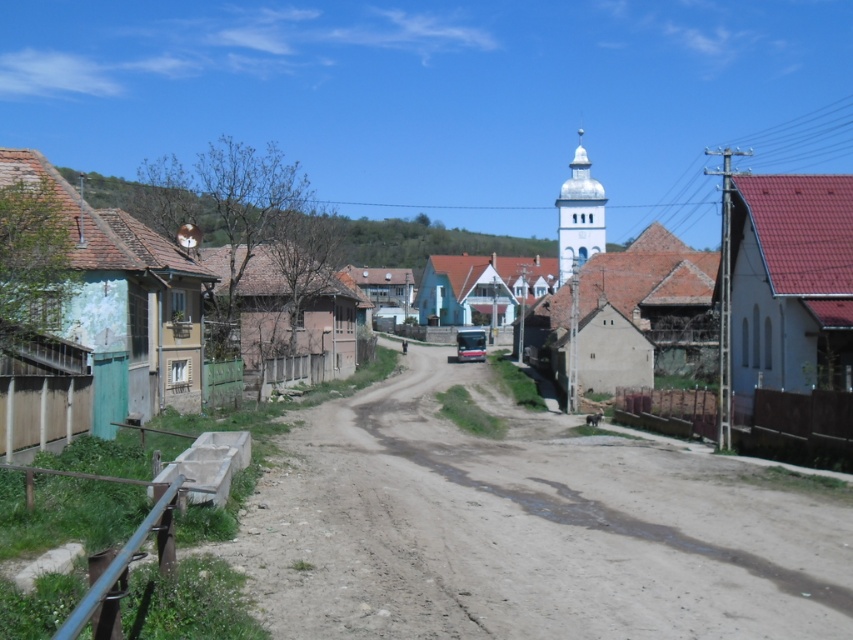
Question: Can you confirm if matte concrete road at center is smaller than white stucco church at center?

Choices:
 (A) yes
 (B) no

Answer: (B)

Question: Which point is closer to the camera?

Choices:
 (A) (561, 552)
 (B) (585, 218)
 (C) (485, 355)

Answer: (A)

Question: Is white stucco church at center closer to camera compared to metallic silver car at center?

Choices:
 (A) no
 (B) yes

Answer: (A)

Question: Does matte concrete road at center lie in front of white stucco church at center?

Choices:
 (A) no
 (B) yes

Answer: (B)

Question: Which object is farther from the camera taking this photo?

Choices:
 (A) white stucco church at center
 (B) metallic silver car at center
 (C) matte concrete road at center

Answer: (A)

Question: Which object is positioned closest to the brown dirt track at center?

Choices:
 (A) white stucco church at center
 (B) matte concrete road at center

Answer: (B)